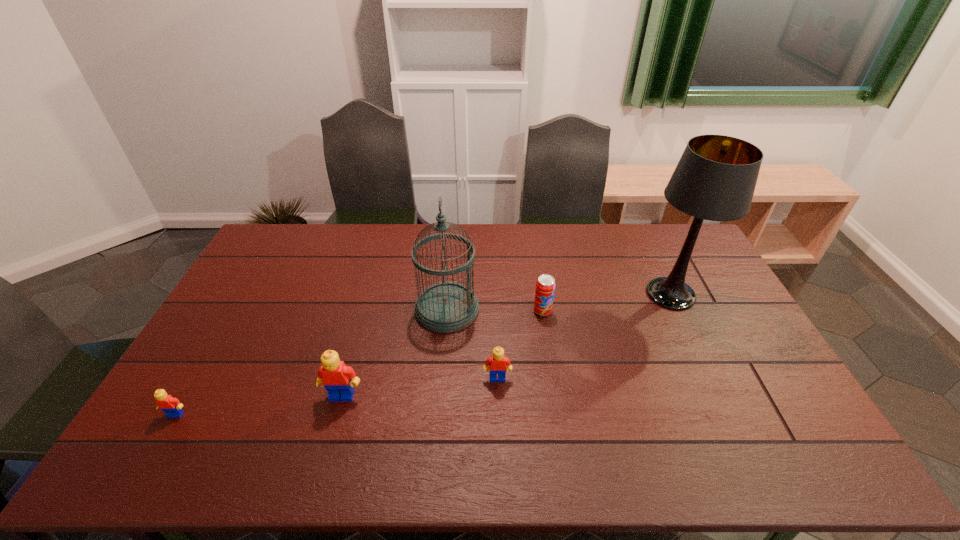
Image resolution: width=960 pixels, height=540 pixels. Identify the location of vacant point located between the fifth shortest object and the third tallest object. (395, 352).

At what (x,y) coordinates should I click in order to perform the action: click on free space between the table lamp and the soda can. Please return your answer as a coordinate pair (x, y). Looking at the image, I should click on (607, 302).

This screenshot has width=960, height=540. What are the coordinates of `free space between the shortest object and the soda can` in the screenshot? It's located at (359, 362).

Where is `empty space between the soda can and the nearest object`? This screenshot has height=540, width=960. empty space between the soda can and the nearest object is located at coordinates pos(359,362).

I want to click on free area in between the rightmost object and the fourth farthest object, so click(x=584, y=336).

This screenshot has height=540, width=960. What are the coordinates of `object that is the second closest one to the tallest object` in the screenshot? It's located at (497, 363).

Locate an element on the screen. This screenshot has width=960, height=540. object that ranks as the third closest to the fourth object from right to left is located at coordinates (338, 379).

Select which Lego is the third closest to the second tallest object. Please provide its 2D coordinates. Your answer should be formatted as a tuple, i.e. [(x, y)], where the tuple contains the x and y coordinates of a point satisfying the conditions above.

[(171, 406)]

Identify the location of Lego that is the closest to the leftmost object. (338, 379).

In order to click on vacant space that satisfies the following two spatial constraints: 1. on the front side of the tallest object; 2. on the front-facing side of the second tallest object in this screenshot , I will do `click(678, 309)`.